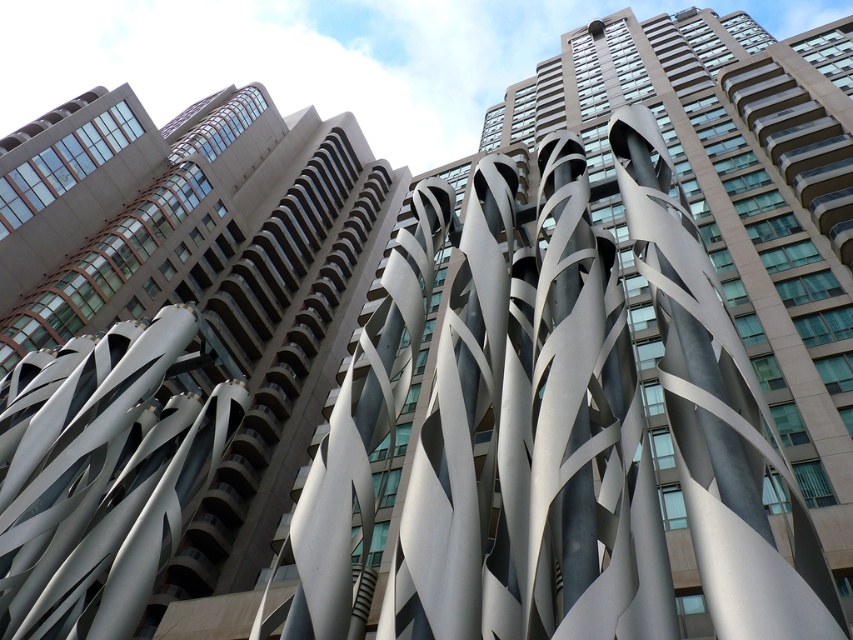
Who is shorter, metallic silver sculpture at center or satin silver sculpture at center?

satin silver sculpture at center

Does point (68, 168) lie behind point (117, 484)?

Yes, point (68, 168) is farther from viewer.

The width and height of the screenshot is (853, 640). I want to click on metallic silver sculpture at center, so click(181, 369).